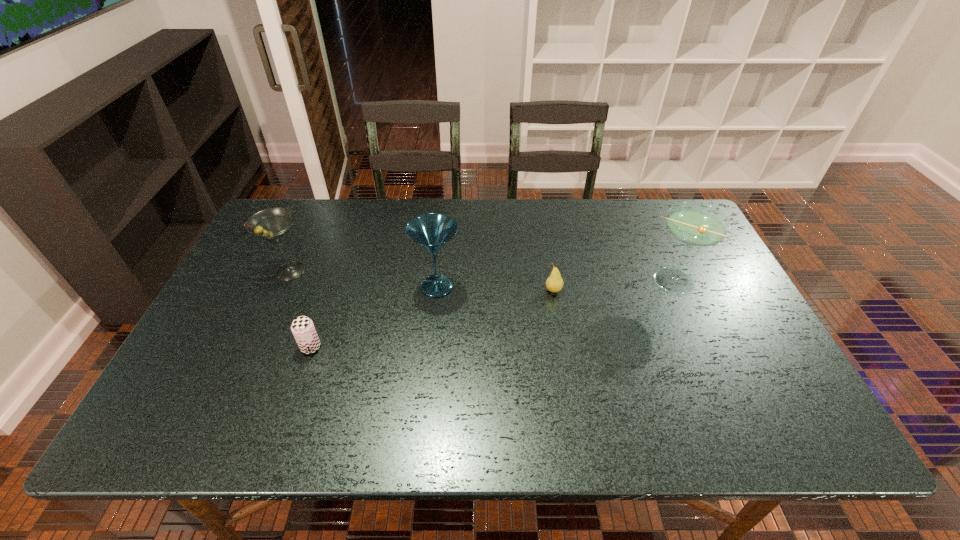
The image size is (960, 540). Find the location of `free space located 0.100m on the right of the nearest object`. free space located 0.100m on the right of the nearest object is located at coordinates (362, 347).

At what (x,y) coordinates should I click in order to perform the action: click on object present at the left edge. Please return your answer as a coordinate pair (x, y). The height and width of the screenshot is (540, 960). Looking at the image, I should click on (273, 224).

At what (x,y) coordinates should I click in order to perform the action: click on object situated at the right edge. Please return your answer as a coordinate pair (x, y). Looking at the image, I should click on (695, 224).

This screenshot has height=540, width=960. Find the location of `free region at the far edge of the desktop`. free region at the far edge of the desktop is located at coordinates (527, 227).

In the image, there is a desktop. In order to click on free space at the near edge in this screenshot , I will do `click(393, 419)`.

At what (x,y) coordinates should I click in order to perform the action: click on vacant space at the left edge of the desktop. Please return your answer as a coordinate pair (x, y). This screenshot has height=540, width=960. Looking at the image, I should click on (251, 269).

The width and height of the screenshot is (960, 540). In the image, there is a desktop. In order to click on free space at the right edge in this screenshot , I will do `click(676, 258)`.

Identify the location of blank space at the near right corner. The image size is (960, 540). (740, 416).

Where is `vacant space in between the rightmost martini and the beer can`? This screenshot has width=960, height=540. vacant space in between the rightmost martini and the beer can is located at coordinates (491, 314).

Where is `empty location between the second object from left to right and the leftmost object`? This screenshot has width=960, height=540. empty location between the second object from left to right and the leftmost object is located at coordinates (300, 309).